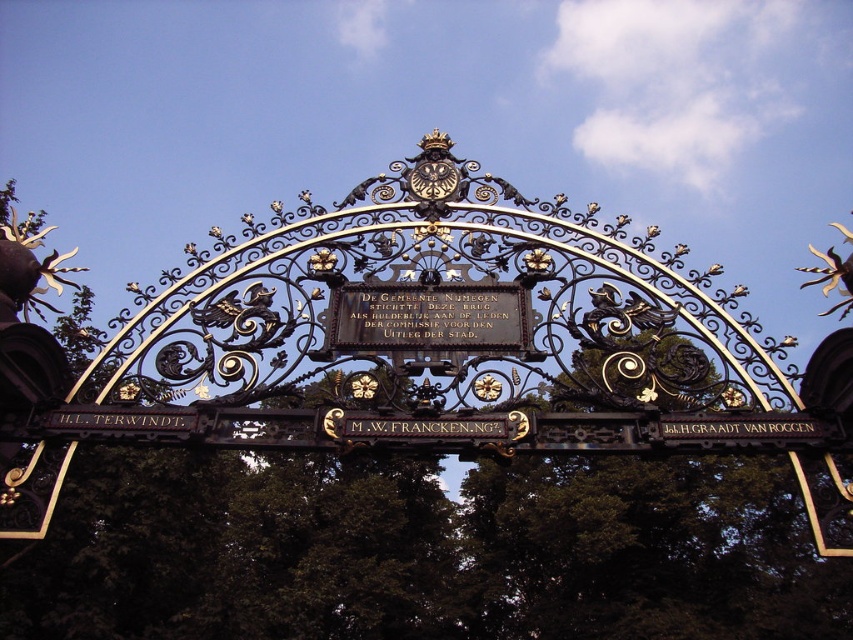
You are a city planner designing a new pathway between the ornate metal archway and the green leafy tree at center. The pathway must be straight and wide enough for a wheelchair. What is the minimum width required for the pathway to accommodate a standard wheelchair?

The minimum width required for the pathway is 1.2 meters, as this is the standard width recommended for wheelchair accessibility, ensuring safe passage between the ornate metal archway and the green leafy tree at center.

What is the significance of the point at coordinates (421, 552) in the image?

The point at coordinates (421, 552) marks the location of a green leafy tree at center in the image.